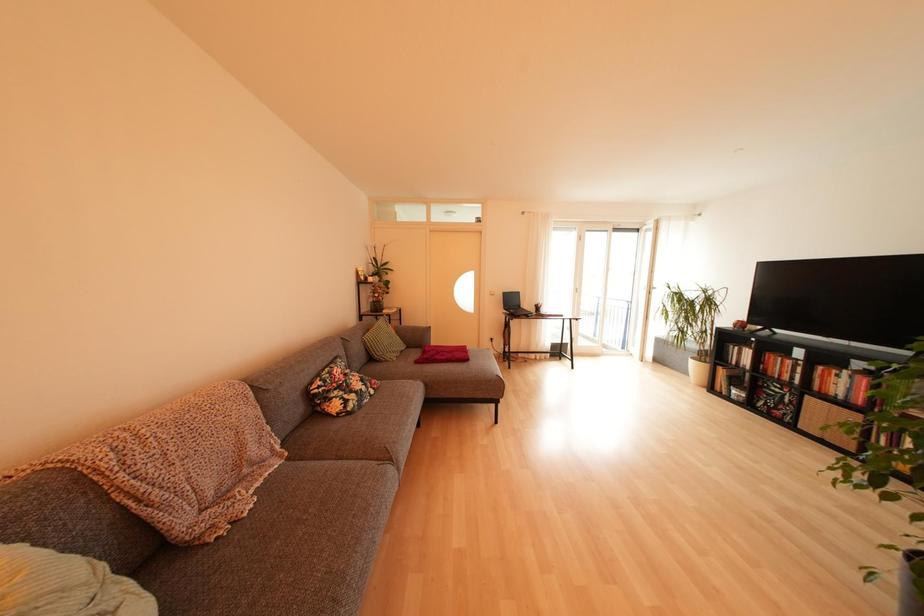
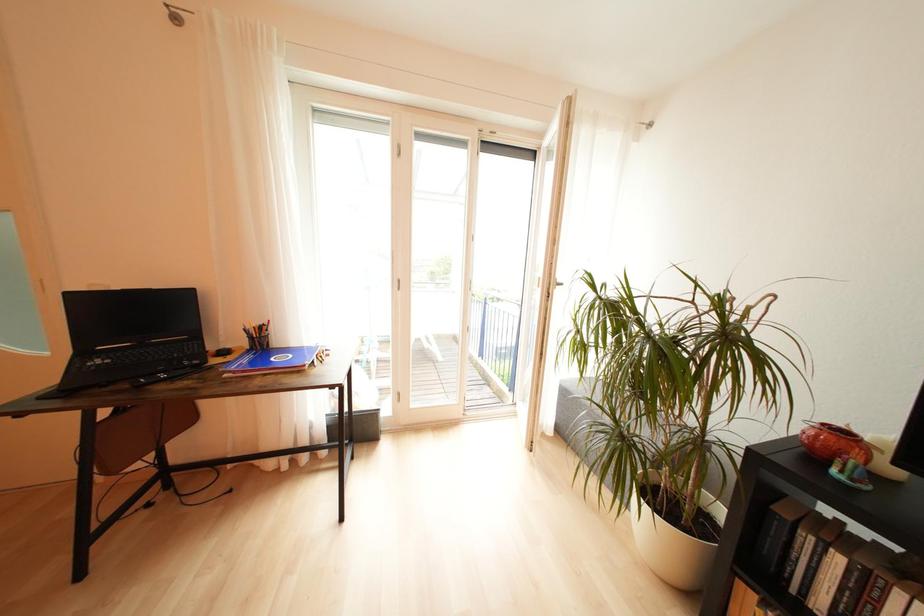
Which direction would the cameraman need to move to produce the second image?

The cameraman moved toward right, forward.